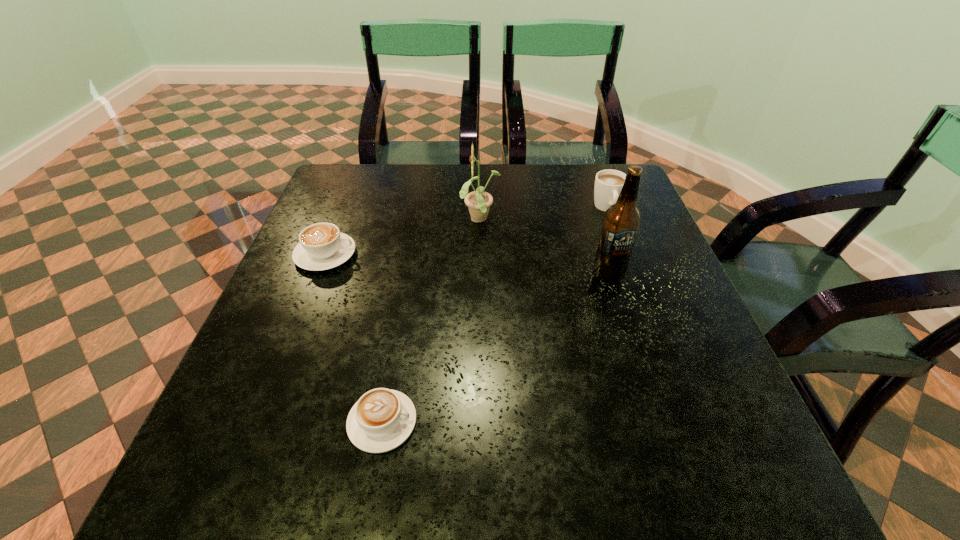
Identify which object is located as the third nearest to the farthest cappuccino. Please provide its 2D coordinates. Your answer should be formatted as a tuple, i.e. [(x, y)], where the tuple contains the x and y coordinates of a point satisfying the conditions above.

[(322, 246)]

This screenshot has width=960, height=540. I want to click on cappuccino that is the third closest one to the sunflower, so click(382, 419).

This screenshot has width=960, height=540. Identify the location of the closest cappuccino relative to the nearest cappuccino. (322, 246).

Locate an element on the screen. Image resolution: width=960 pixels, height=540 pixels. free spot that satisfies the following two spatial constraints: 1. with the handle on the side of the third tallest object; 2. on the side of the fourth tallest object with the handle is located at coordinates (625, 254).

The width and height of the screenshot is (960, 540). Identify the location of blank area in the image that satisfies the following two spatial constraints: 1. with the handle on the side of the third shortest object; 2. on the side of the second nearest cappuccino with the handle. (625, 254).

I want to click on free space that satisfies the following two spatial constraints: 1. on the label of the tallest object; 2. with the handle on the right side of the nearest cappuccino, so click(654, 422).

Find the location of `free space that satisfies the following two spatial constraints: 1. with the handle on the side of the third tallest object; 2. on the side of the fourth tallest object with the handle`. free space that satisfies the following two spatial constraints: 1. with the handle on the side of the third tallest object; 2. on the side of the fourth tallest object with the handle is located at coordinates (625, 254).

Locate an element on the screen. This screenshot has height=540, width=960. free location that satisfies the following two spatial constraints: 1. on the label of the beer bottle; 2. with the handle on the right side of the shortest object is located at coordinates (654, 422).